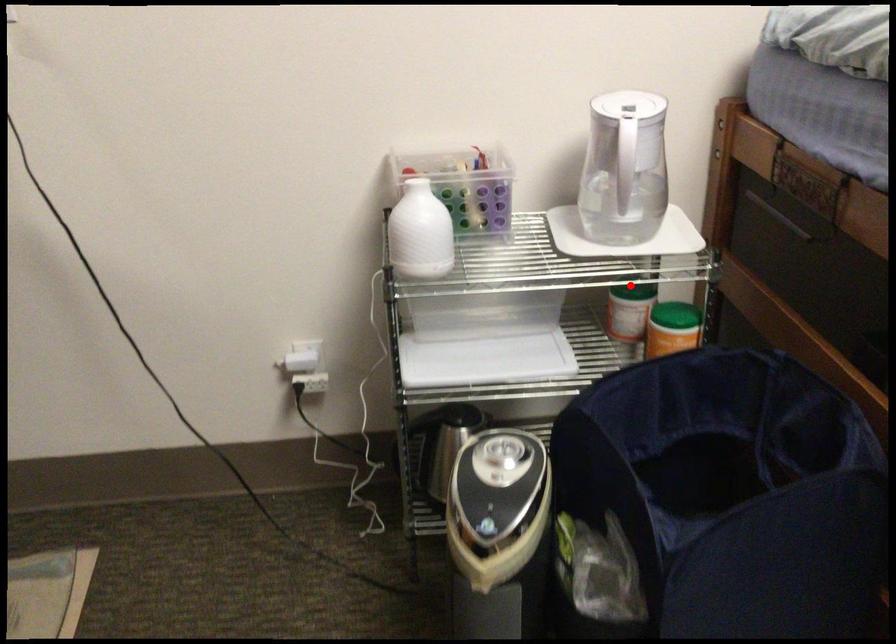
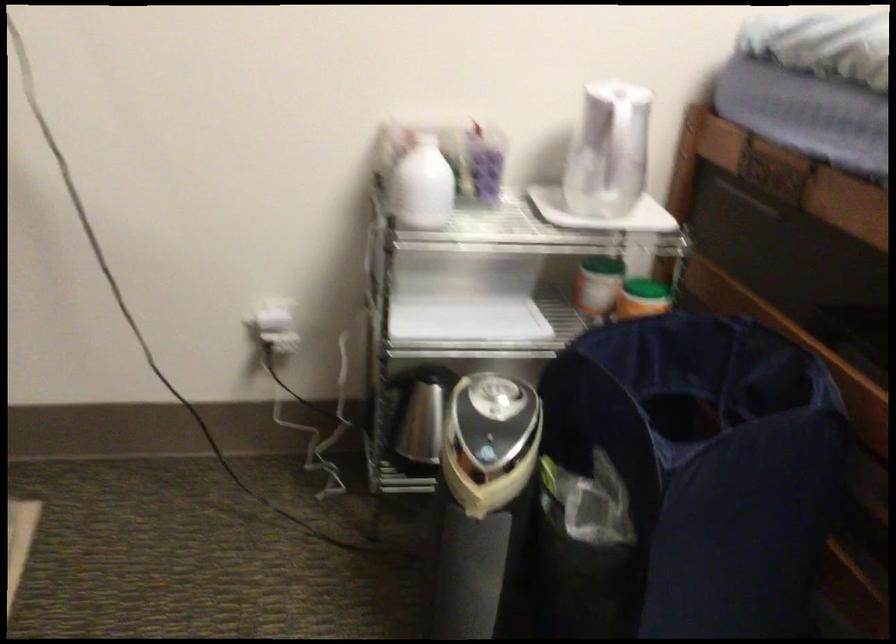
In the second image, find the point that corresponds to the highlighted location in the first image.

(602, 263)